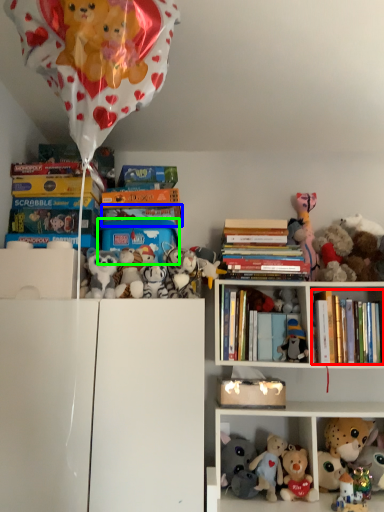
Question: Which object is positioned closest to book (highlighted by a red box)? Select from book (highlighted by a blue box) and box (highlighted by a green box).

Choices:
 (A) book
 (B) box

Answer: (B)